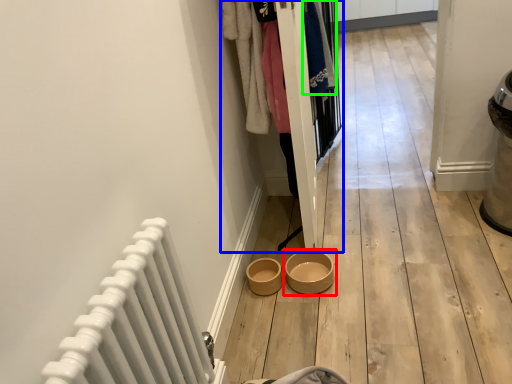
Question: Based on their relative distances, which object is nearer to bowl (highlighted by a red box)? Choose from closet (highlighted by a blue box) and clothing (highlighted by a green box).

Choices:
 (A) closet
 (B) clothing

Answer: (A)